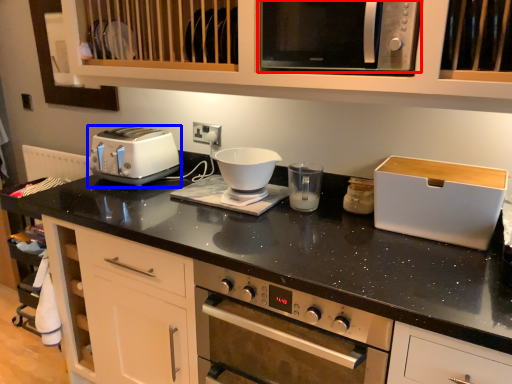
Question: Which object appears closest to the camera in this image, microwave oven (highlighted by a red box) or toaster (highlighted by a blue box)?

Choices:
 (A) microwave oven
 (B) toaster

Answer: (A)